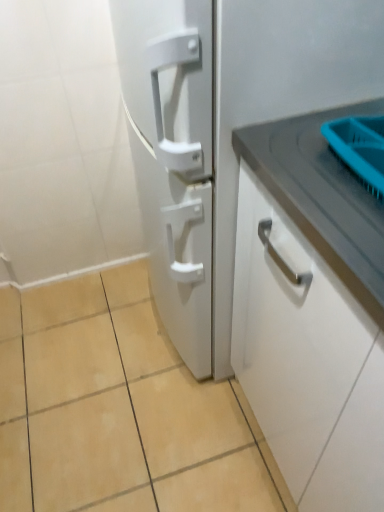
Question: From the image's perspective, is white matte refrigerator at center on top of beige ceramic tile at lower center?

Choices:
 (A) yes
 (B) no

Answer: (A)

Question: Is white matte refrigerator at center in front of beige ceramic tile at lower center?

Choices:
 (A) yes
 (B) no

Answer: (A)

Question: Can you confirm if white matte refrigerator at center is bigger than beige ceramic tile at lower center?

Choices:
 (A) yes
 (B) no

Answer: (A)

Question: Could you tell me if white matte refrigerator at center is turned towards beige ceramic tile at lower center?

Choices:
 (A) no
 (B) yes

Answer: (B)

Question: Considering the relative sizes of white matte refrigerator at center and beige ceramic tile at lower center in the image provided, is white matte refrigerator at center shorter than beige ceramic tile at lower center?

Choices:
 (A) no
 (B) yes

Answer: (A)

Question: Are white matte refrigerator at center and beige ceramic tile at lower center making contact?

Choices:
 (A) yes
 (B) no

Answer: (B)

Question: From a real-world perspective, is white matte cabinet handle at right beneath beige ceramic tile at lower center?

Choices:
 (A) yes
 (B) no

Answer: (B)

Question: Is white matte cabinet handle at right closer to camera compared to beige ceramic tile at lower center?

Choices:
 (A) no
 (B) yes

Answer: (B)

Question: Can you confirm if white matte cabinet handle at right is shorter than beige ceramic tile at lower center?

Choices:
 (A) no
 (B) yes

Answer: (A)

Question: Could you tell me if white matte cabinet handle at right is facing beige ceramic tile at lower center?

Choices:
 (A) yes
 (B) no

Answer: (B)

Question: Does white matte cabinet handle at right contain beige ceramic tile at lower center?

Choices:
 (A) no
 (B) yes

Answer: (A)

Question: From the image's perspective, does white matte cabinet handle at right appear lower than beige ceramic tile at lower center?

Choices:
 (A) yes
 (B) no

Answer: (B)

Question: Is white matte cabinet handle at right at the right side of white matte refrigerator at center?

Choices:
 (A) yes
 (B) no

Answer: (A)